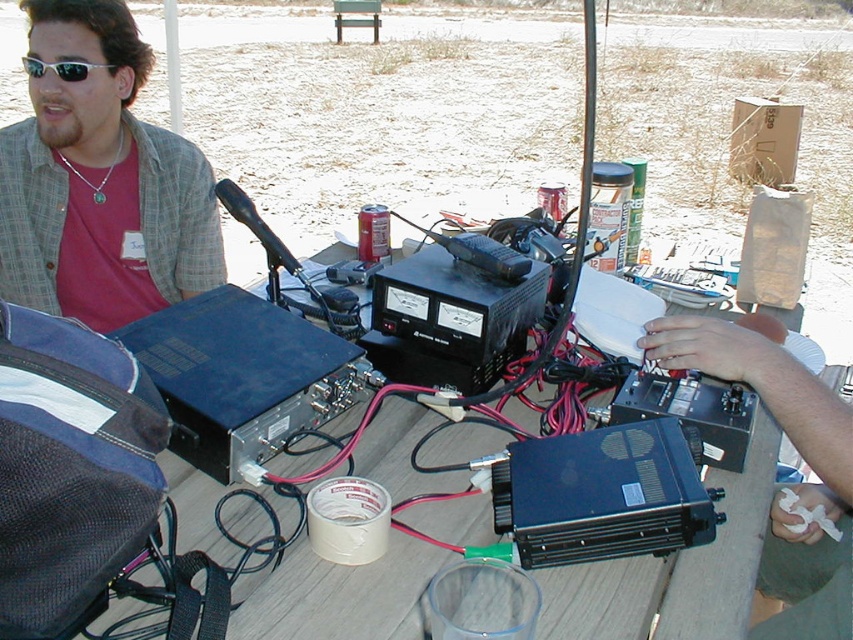
You are standing in the scene and want to pick up the wooden table at center. Can you reach it without moving the matte black shirt at left?

The matte black shirt at left is further to the viewer than wooden table at center, so you can reach the wooden table at center without moving the matte black shirt at left.

You are standing at the center of the table where the radio equipment is placed. You need to find the matte black shirt at left. According to the coordinates provided, in which direction should you look to locate it?

The matte black shirt at left is located at point coordinates, so you should look to the left side from the center of the table to find it.

From the picture: You are a photographer standing next to the camera. You want to take a picture of the matte black shirt at left without moving the shirt. Can you do it from your current position?

The matte black shirt at left and camera are 4.77 feet apart from each other, so yes, you can take the picture from your current position as the distance is sufficient.